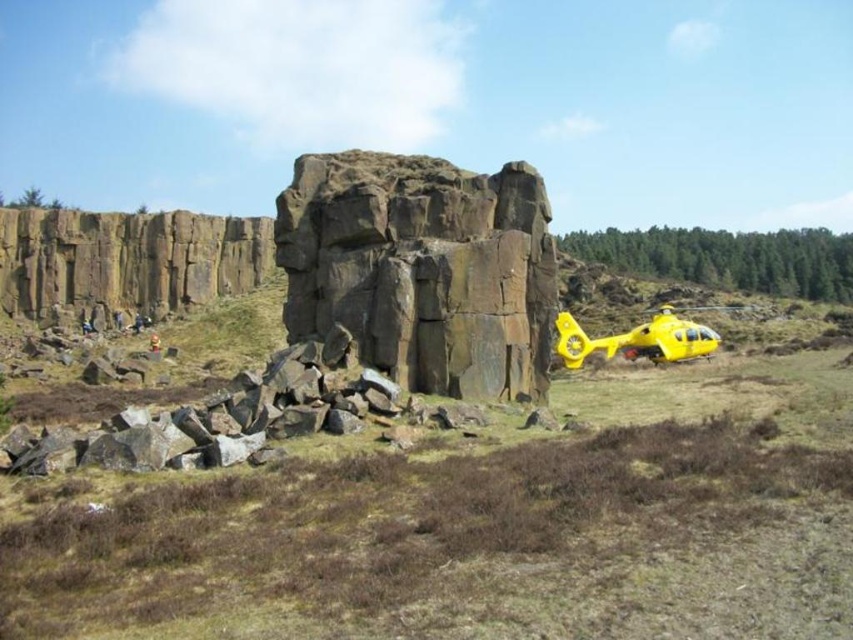
Question: Which object is farther from the camera taking this photo?

Choices:
 (A) dark gray stone rock at center
 (B) yellow matte helicopter at right
 (C) yellow plastic helicopter at right

Answer: (B)

Question: Which object is positioned farthest from the yellow matte helicopter at right?

Choices:
 (A) yellow plastic helicopter at right
 (B) dark gray stone rock at center

Answer: (B)

Question: Is dark gray stone rock at center above yellow matte helicopter at right?

Choices:
 (A) no
 (B) yes

Answer: (B)

Question: Among these points, which one is farthest from the camera?

Choices:
 (A) click(576, 332)
 (B) click(657, 397)

Answer: (A)

Question: In this image, where is yellow plastic helicopter at right located relative to dark gray stone rock at center?

Choices:
 (A) below
 (B) above

Answer: (A)

Question: Is yellow plastic helicopter at right bigger than yellow matte helicopter at right?

Choices:
 (A) yes
 (B) no

Answer: (A)